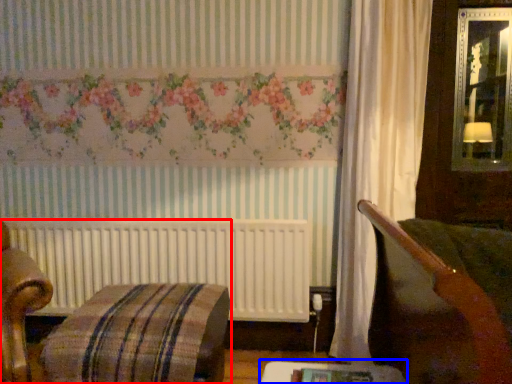
Question: Which object is further to the camera taking this photo, furniture (highlighted by a red box) or table (highlighted by a blue box)?

Choices:
 (A) furniture
 (B) table

Answer: (A)